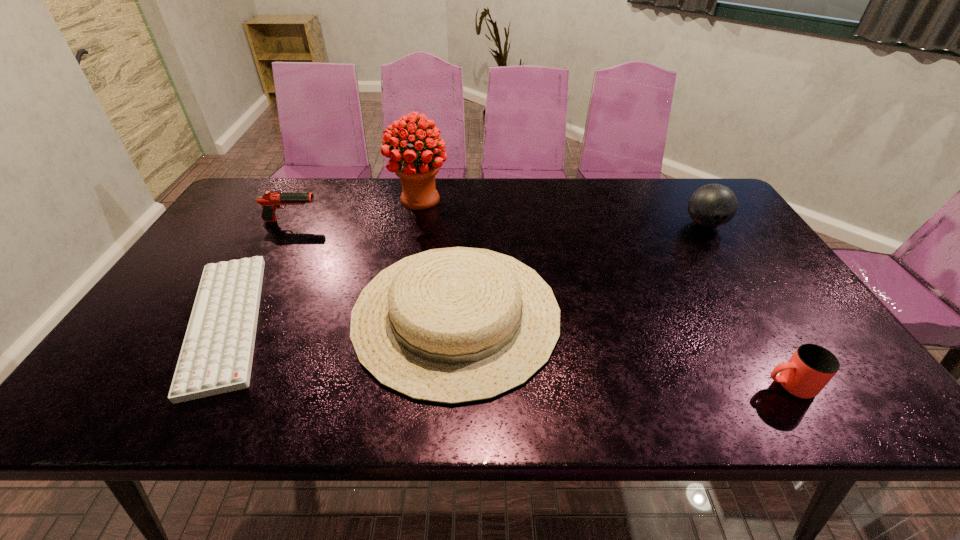
At what (x,y) coordinates should I click in order to perform the action: click on computer keyboard that is at the left edge. Please return your answer as a coordinate pair (x, y). Image resolution: width=960 pixels, height=540 pixels. Looking at the image, I should click on (216, 357).

Image resolution: width=960 pixels, height=540 pixels. What are the coordinates of `bowling ball present at the right edge` in the screenshot? It's located at (713, 205).

The width and height of the screenshot is (960, 540). Identify the location of cup situated at the right edge. (810, 368).

Where is `object located in the near left corner section of the desktop`? object located in the near left corner section of the desktop is located at coordinates (216, 357).

In order to click on object that is at the far right corner in this screenshot , I will do `click(713, 205)`.

Identify the location of object that is at the near right corner. (810, 368).

Identify the location of free region at the far edge of the desktop. (570, 201).

You are a GUI agent. You are given a task and a screenshot of the screen. Output one action in this format:
    pyautogui.click(x=<x>, y=<y>)
    Task: Click on the vacant space at the near edge of the desktop
    The height and width of the screenshot is (540, 960).
    Given the screenshot: What is the action you would take?
    pyautogui.click(x=658, y=407)

Where is `vacant space at the left edge of the desktop`? The width and height of the screenshot is (960, 540). vacant space at the left edge of the desktop is located at coordinates (238, 237).

What are the coordinates of `vacant space at the near left corner of the desktop` in the screenshot? It's located at (95, 413).